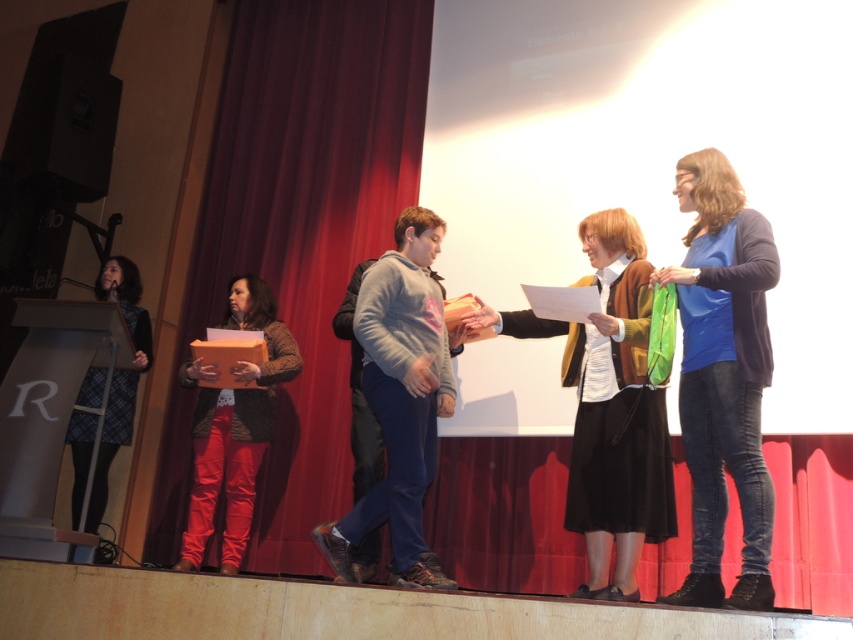
You are an event planner looking to adjust the stage setup. You need to place a decorative banner between the red velvet curtain at center and the plaid skirt at left. Based on their positions, where should the banner be placed relative to these two objects?

The red velvet curtain at center is located above the plaid skirt at left, so the banner should be placed between them, hanging from the curtain downwards towards the plaid skirt at left to maintain a vertical alignment.

In the scene shown: You are an event coordinator planning to place a decorative arrangement at the center of the stage. There is already an object at point (608,406). What is the object located at that point?

The object at point (608,406) is the matte brown cardigan at center.

You are a photographer positioned at the back of the stage. You want to take a photo that includes both the point at (x=322, y=260) and the point at (x=219, y=451). Which point is closer to your camera?

Point (x=219, y=451) is closer to the camera than point (x=322, y=260), so it will appear nearer in the photo.